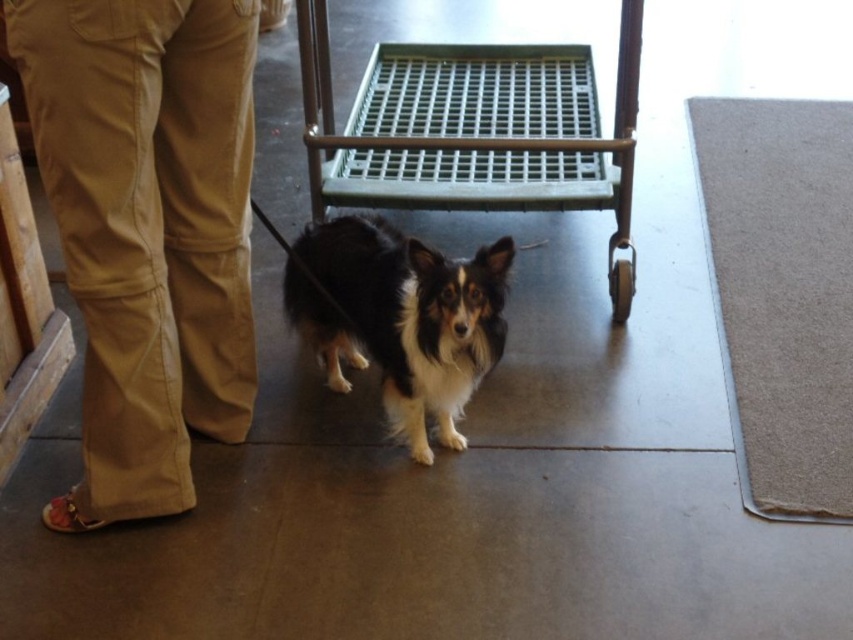
Consider the image. Is metallic grid cart at center taller than black and white fur dog at center?

Indeed, metallic grid cart at center has a greater height compared to black and white fur dog at center.

Describe the element at coordinates (474, 131) in the screenshot. I see `metallic grid cart at center` at that location.

Find the location of `metallic grid cart at center`. metallic grid cart at center is located at coordinates (474, 131).

Can you confirm if tan cotton pants at lower left is smaller than black and white fur dog at center?

No.

Between point (30, 45) and point (447, 285), which one is positioned behind?

Point (447, 285)

This screenshot has height=640, width=853. What are the coordinates of `tan cotton pants at lower left` in the screenshot? It's located at (148, 230).

Is the position of tan cotton pants at lower left more distant than that of metallic grid cart at center?

No, tan cotton pants at lower left is closer to the viewer.

Which is below, tan cotton pants at lower left or metallic grid cart at center?

Positioned lower is tan cotton pants at lower left.

At what (x,y) coordinates should I click in order to perform the action: click on tan cotton pants at lower left. Please return your answer as a coordinate pair (x, y). This screenshot has width=853, height=640. Looking at the image, I should click on (148, 230).